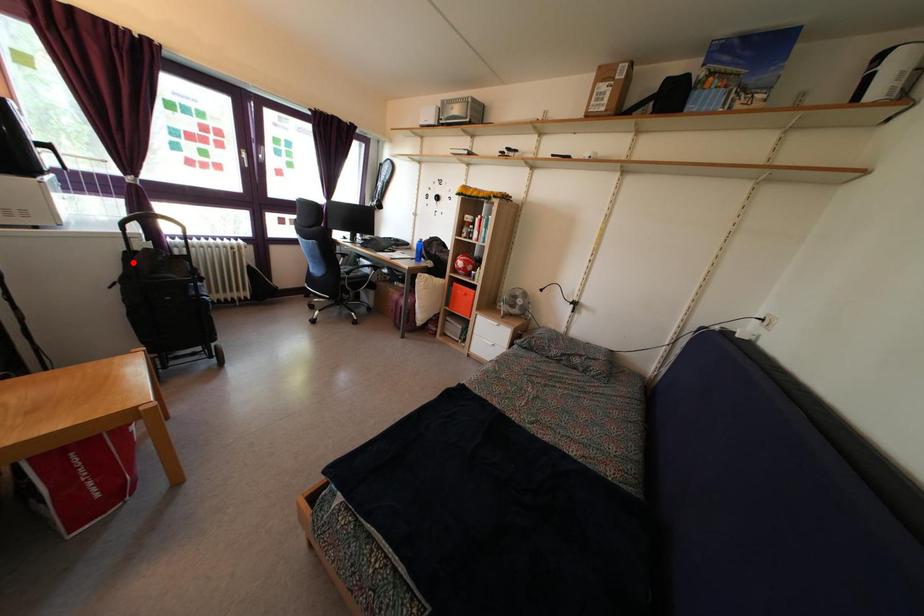
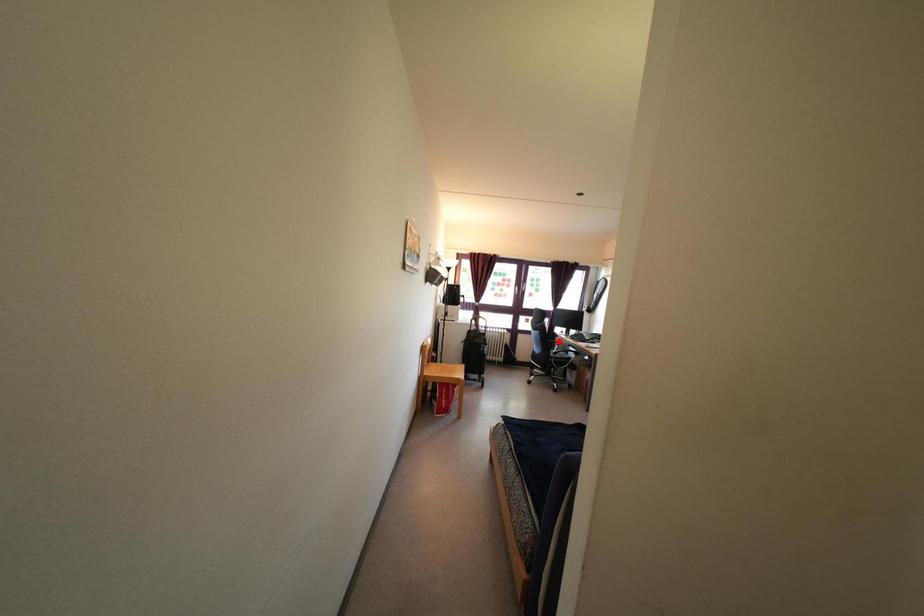
I am providing you with two images of the same scene from different viewpoints. A red point is marked on the first image and another point is marked on the second image. Is the red point in image1 aligned with the point shown in image2?

No